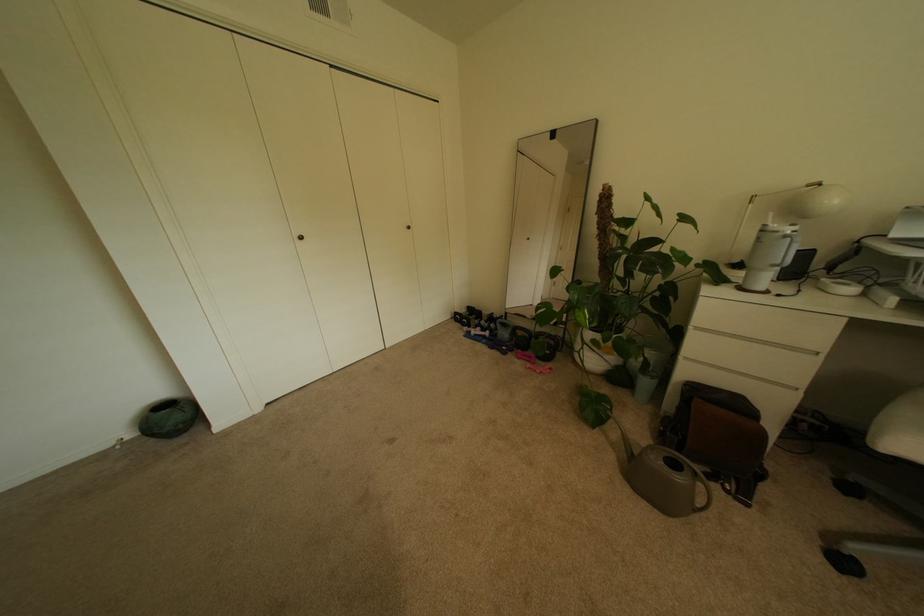
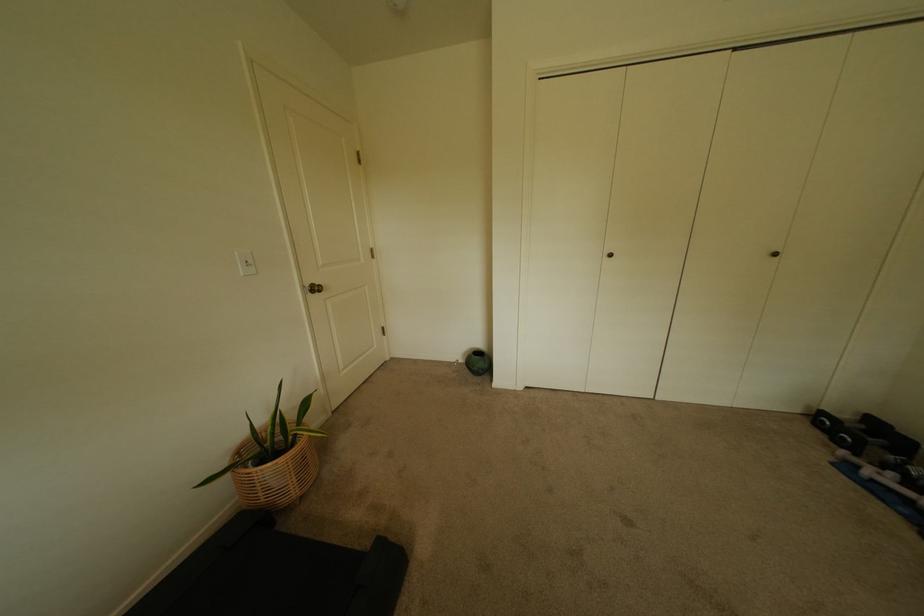
Find the pixel in the second image that matches (310,238) in the first image.

(618, 256)